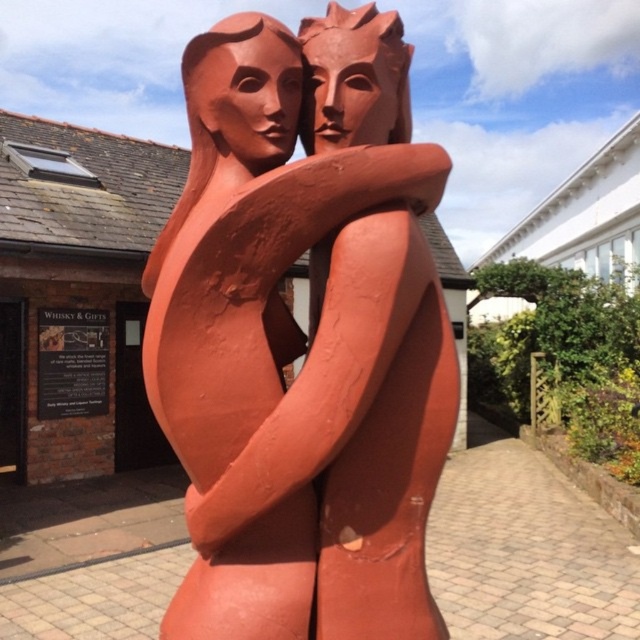
Looking at this image, does terracotta statue at center appear on the left side of matte terracotta head at center?

Correct, you'll find terracotta statue at center to the left of matte terracotta head at center.

This screenshot has width=640, height=640. What do you see at coordinates (301, 339) in the screenshot?
I see `terracotta statue at center` at bounding box center [301, 339].

The image size is (640, 640). I want to click on terracotta statue at center, so click(x=301, y=339).

Does terracotta statue at center come in front of matte terracotta head at upper center?

Yes.

Who is more forward, (x=342, y=300) or (x=236, y=38)?

Point (x=342, y=300) is in front.

Find the location of a particular element. terracotta statue at center is located at coordinates (301, 339).

Which is above, matte terracotta head at center or matte terracotta head at upper center?

matte terracotta head at center is higher up.

Does matte terracotta head at center have a larger size compared to matte terracotta head at upper center?

Yes, matte terracotta head at center is bigger than matte terracotta head at upper center.

This screenshot has height=640, width=640. Describe the element at coordinates (355, 77) in the screenshot. I see `matte terracotta head at center` at that location.

You are a GUI agent. You are given a task and a screenshot of the screen. Output one action in this format:
    pyautogui.click(x=<x>, y=<y>)
    Task: Click on the matte terracotta head at center
    
    Given the screenshot: What is the action you would take?
    pyautogui.click(x=355, y=77)